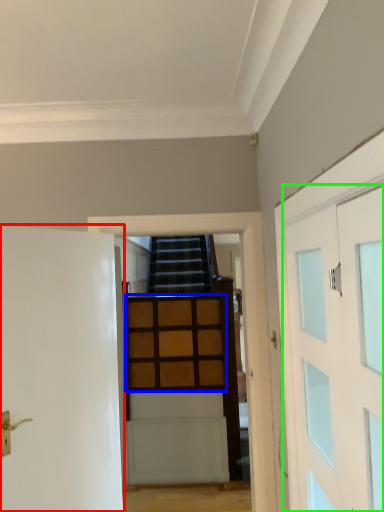
Question: Estimate the real-world distances between objects in this image. Which object is farther from door (highlighted by a red box), cabinetry (highlighted by a blue box) or door (highlighted by a green box)?

Choices:
 (A) cabinetry
 (B) door

Answer: (A)